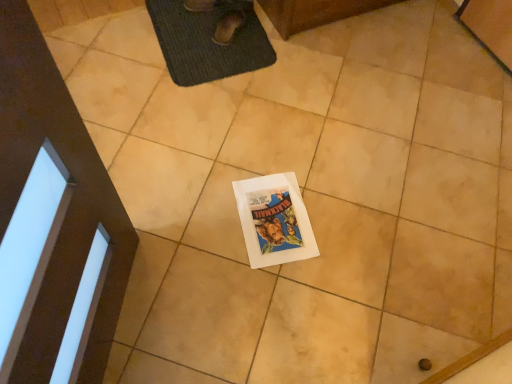
At what (x,y) coordinates should I click in order to perform the action: click on vacant area that is in front of brown suede shoe at upper center. Please return your answer as a coordinate pair (x, y). Looking at the image, I should click on click(x=221, y=57).